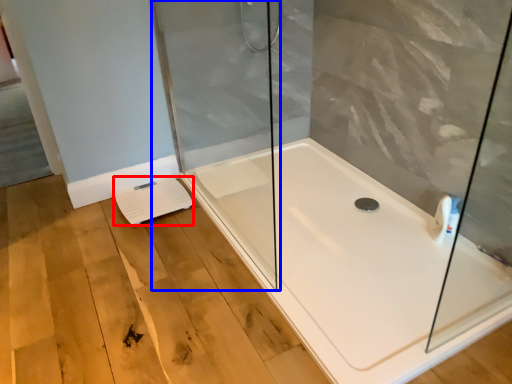
Question: Which point is closer to the camera, lift (highlighted by a red box) or shower door (highlighted by a blue box)?

Choices:
 (A) lift
 (B) shower door

Answer: (B)